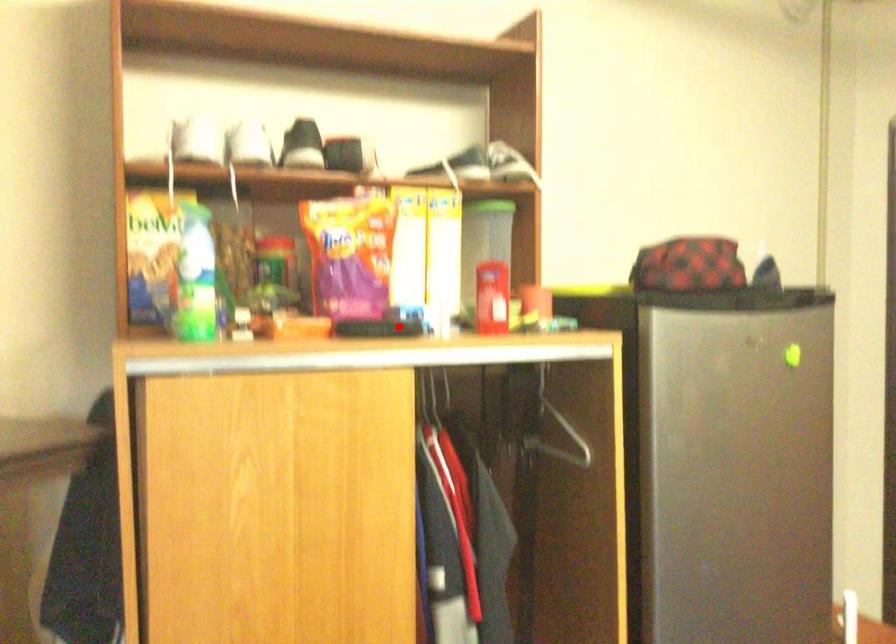
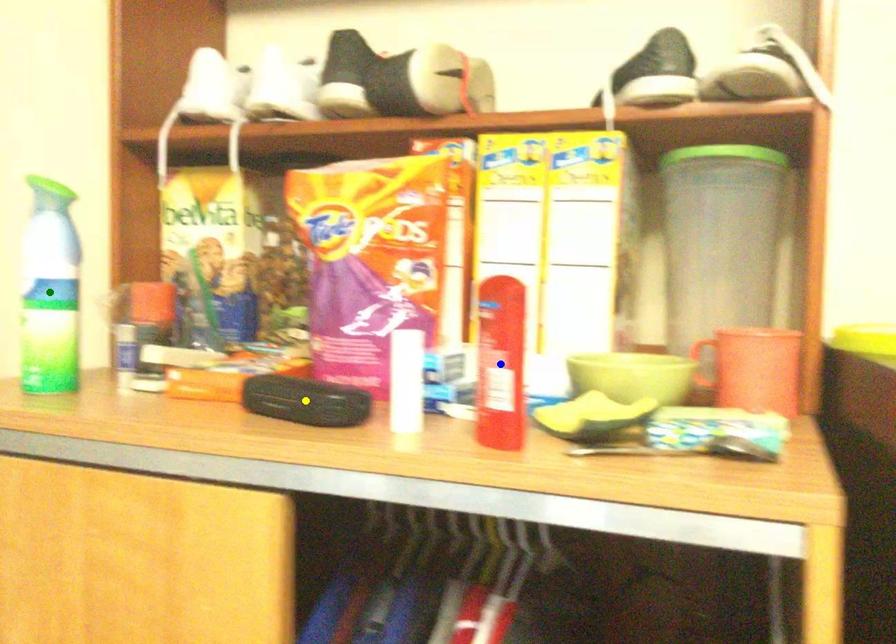
Question: I am providing you with two images of the same scene from different viewpoints. A red point is marked on the first image. You are given multiple points on the second image. Can you choose the point in image 2 that corresponds to the point in image 1?

Choices:
 (A) yellow point
 (B) blue point
 (C) green point

Answer: (A)